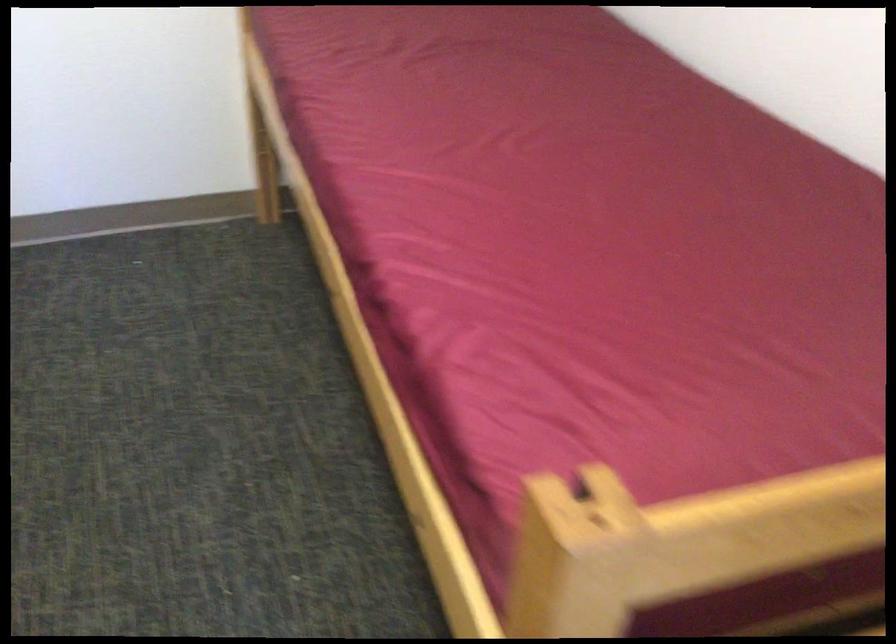
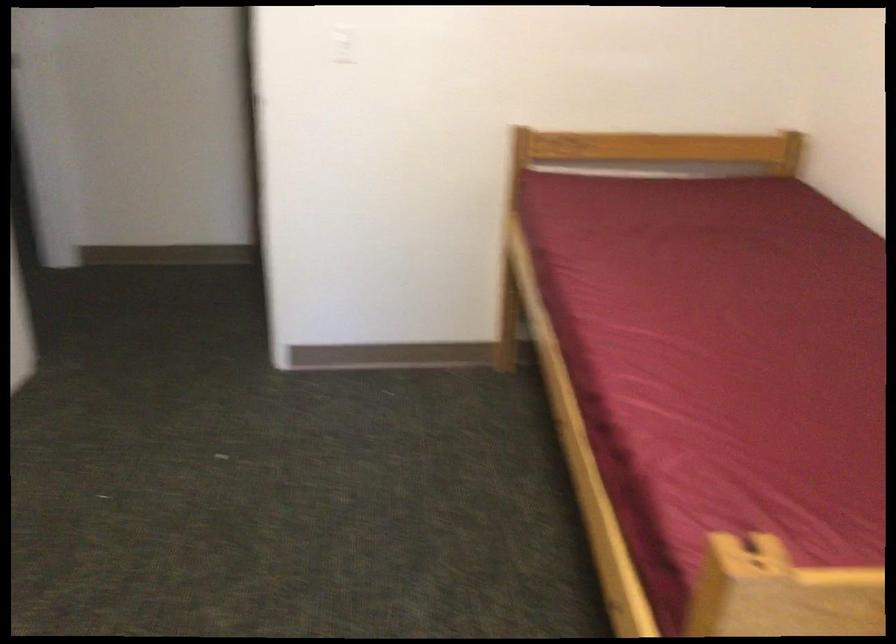
Find the pixel in the second image that matches pixel 633 536 in the first image.

(805, 603)